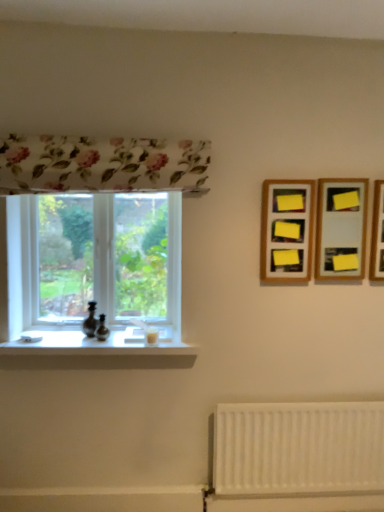
Question: Can yellow paper at upper right, which is the 2th picture frame from right to left, be found inside wooden frame at upper right, marked as the 1th picture frame in a left-to-right arrangement?

Choices:
 (A) yes
 (B) no

Answer: (B)

Question: Is wooden frame at upper right, acting as the third picture frame starting from the right, bigger than yellow paper at upper right, the second picture frame viewed from the left?

Choices:
 (A) yes
 (B) no

Answer: (A)

Question: Is wooden frame at upper right, marked as the 1th picture frame in a left-to-right arrangement, to the right of yellow paper at upper right, the second picture frame viewed from the left, from the viewer's perspective?

Choices:
 (A) yes
 (B) no

Answer: (B)

Question: Is wooden frame at upper right, marked as the 1th picture frame in a left-to-right arrangement, facing towards yellow paper at upper right, the second picture frame viewed from the left?

Choices:
 (A) yes
 (B) no

Answer: (B)

Question: Is wooden frame at upper right, marked as the 1th picture frame in a left-to-right arrangement, at the left side of yellow paper at upper right, the second picture frame viewed from the left?

Choices:
 (A) yes
 (B) no

Answer: (A)

Question: Is wooden frame at upper right, marked as the 1th picture frame in a left-to-right arrangement, shorter than yellow paper at upper right, the second picture frame viewed from the left?

Choices:
 (A) no
 (B) yes

Answer: (A)

Question: From a real-world perspective, is white glossy window sill at lower left positioned over clear glass window at left based on gravity?

Choices:
 (A) no
 (B) yes

Answer: (A)

Question: Is white glossy window sill at lower left to the left of clear glass window at left from the viewer's perspective?

Choices:
 (A) no
 (B) yes

Answer: (B)

Question: Does white glossy window sill at lower left lie behind clear glass window at left?

Choices:
 (A) yes
 (B) no

Answer: (B)

Question: Is white glossy window sill at lower left next to clear glass window at left and touching it?

Choices:
 (A) no
 (B) yes

Answer: (A)

Question: Can you confirm if white glossy window sill at lower left is bigger than clear glass window at left?

Choices:
 (A) no
 (B) yes

Answer: (A)

Question: Considering the relative positions of white glossy window sill at lower left and clear glass window at left in the image provided, is white glossy window sill at lower left to the right of clear glass window at left from the viewer's perspective?

Choices:
 (A) yes
 (B) no

Answer: (B)

Question: Considering the relative positions of yellow paper at upper right, the second picture frame viewed from the left, and white matte radiator at lower right in the image provided, is yellow paper at upper right, the second picture frame viewed from the left, to the right of white matte radiator at lower right from the viewer's perspective?

Choices:
 (A) no
 (B) yes

Answer: (B)